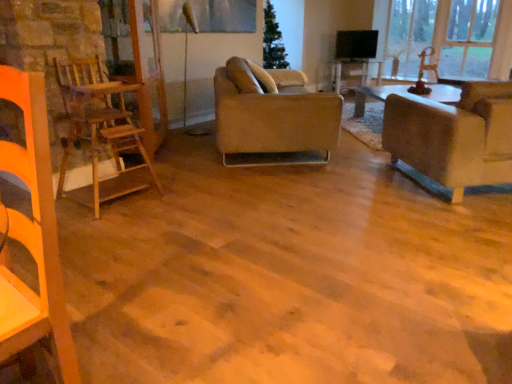
Question: Could you tell me if wooden table at center is facing leather couch at center, which appears as the 2th studio couch when viewed from the right?

Choices:
 (A) yes
 (B) no

Answer: (B)

Question: Can you confirm if wooden table at center is thinner than leather couch at center, the 1th studio couch from the left?

Choices:
 (A) yes
 (B) no

Answer: (A)

Question: Does wooden table at center have a lesser height compared to leather couch at center, which appears as the 2th studio couch when viewed from the right?

Choices:
 (A) no
 (B) yes

Answer: (B)

Question: From a real-world perspective, is wooden table at center physically above leather couch at center, which appears as the 2th studio couch when viewed from the right?

Choices:
 (A) no
 (B) yes

Answer: (A)

Question: From the image's perspective, is wooden table at center on leather couch at center, the 1th studio couch from the left?

Choices:
 (A) no
 (B) yes

Answer: (B)

Question: In the image, is leather couch at center, which appears as the 2th studio couch when viewed from the right, on the left side or the right side of wooden ladder at left?

Choices:
 (A) right
 (B) left

Answer: (A)

Question: From a real-world perspective, relative to wooden ladder at left, is leather couch at center, the 1th studio couch from the left, vertically above or below?

Choices:
 (A) below
 (B) above

Answer: (A)

Question: Looking at the image, does leather couch at center, which appears as the 2th studio couch when viewed from the right, seem bigger or smaller compared to wooden ladder at left?

Choices:
 (A) big
 (B) small

Answer: (A)

Question: From the image's perspective, relative to wooden ladder at left, is leather couch at center, which appears as the 2th studio couch when viewed from the right, above or below?

Choices:
 (A) below
 (B) above

Answer: (B)

Question: Is transparent glass window at upper right bigger or smaller than wooden table at center?

Choices:
 (A) small
 (B) big

Answer: (B)

Question: Relative to wooden table at center, is transparent glass window at upper right in front or behind?

Choices:
 (A) behind
 (B) front

Answer: (B)

Question: In terms of width, does transparent glass window at upper right look wider or thinner when compared to wooden table at center?

Choices:
 (A) thin
 (B) wide

Answer: (A)

Question: From the image's perspective, relative to wooden table at center, is transparent glass window at upper right above or below?

Choices:
 (A) below
 (B) above

Answer: (B)

Question: Looking at the image, does transparent glass window at upper right seem bigger or smaller compared to wooden ladder at left?

Choices:
 (A) big
 (B) small

Answer: (A)

Question: Considering the positions of transparent glass window at upper right and wooden ladder at left in the image, is transparent glass window at upper right taller or shorter than wooden ladder at left?

Choices:
 (A) short
 (B) tall

Answer: (B)